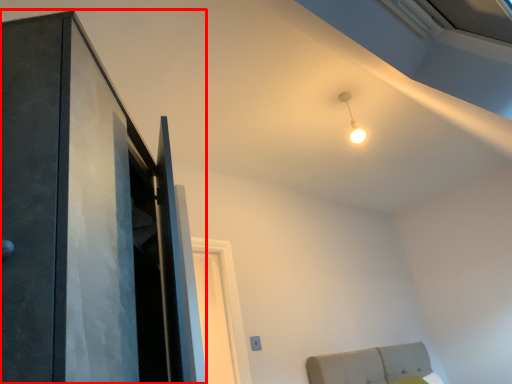
Question: Considering the relative positions of door (annotated by the red box) and light in the image provided, where is door (annotated by the red box) located with respect to the staircase?

Choices:
 (A) left
 (B) right

Answer: (A)